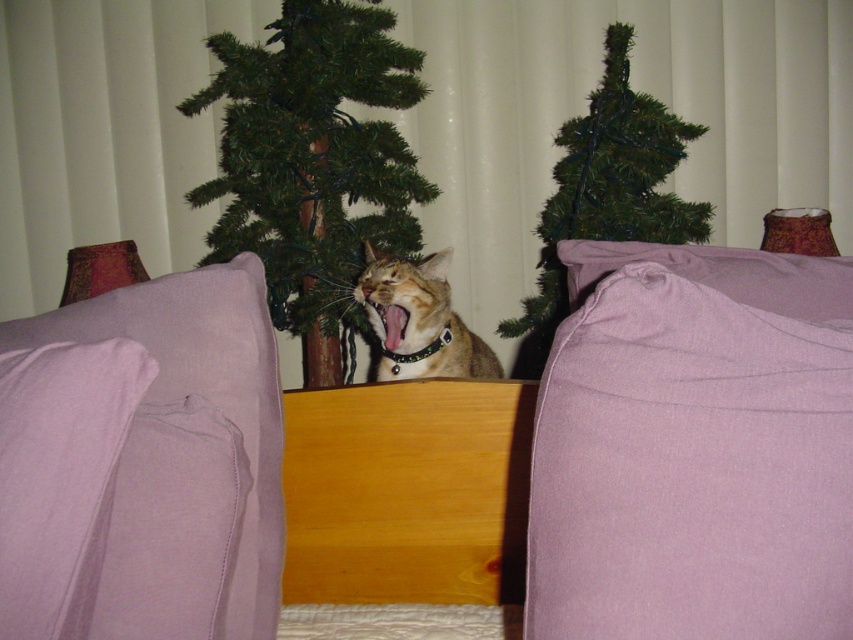
Between point (816, 401) and point (396, 323), which one is positioned in front?

Point (816, 401)

Is purple fabric bed at center wider than tabby fur cat at center?

Yes, purple fabric bed at center is wider than tabby fur cat at center.

Does point (775, 476) come in front of point (444, 369)?

That is True.

What are the coordinates of `purple fabric bed at center` in the screenshot? It's located at (607, 460).

Which of these two, lavender cotton blanket at lower right or tabby fur cat at center, stands shorter?

Standing shorter between the two is tabby fur cat at center.

Is lavender cotton blanket at lower right wider than tabby fur cat at center?

Indeed, lavender cotton blanket at lower right has a greater width compared to tabby fur cat at center.

Describe the element at coordinates (694, 448) in the screenshot. I see `lavender cotton blanket at lower right` at that location.

Where is `lavender cotton blanket at lower right`? lavender cotton blanket at lower right is located at coordinates (694, 448).

Does point (387, 132) come farther from viewer compared to point (38, 564)?

Yes, it is behind point (38, 564).

Based on the photo, can you confirm if green artificial tree at upper center is shorter than purple fabric pillow at left?

Incorrect, green artificial tree at upper center's height does not fall short of purple fabric pillow at left's.

The width and height of the screenshot is (853, 640). I want to click on green artificial tree at upper center, so click(x=312, y=164).

Where is `green artificial tree at upper center`? Image resolution: width=853 pixels, height=640 pixels. green artificial tree at upper center is located at coordinates (312, 164).